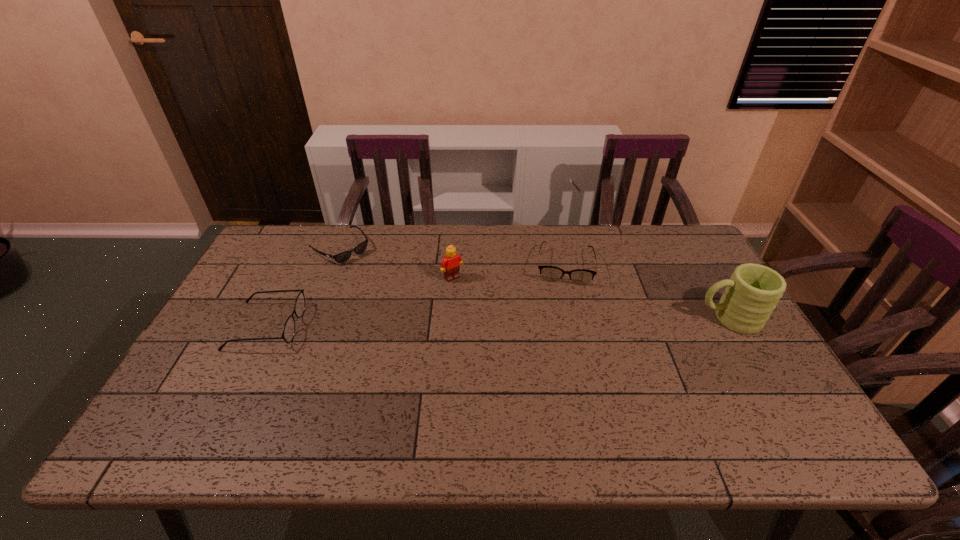
Locate an element on the screen. Image resolution: width=960 pixels, height=540 pixels. the nearer spectacles is located at coordinates (288, 332).

Image resolution: width=960 pixels, height=540 pixels. What are the coordinates of `the rightmost object` in the screenshot? It's located at (x=751, y=294).

At what (x,y) coordinates should I click in order to perform the action: click on mug. Please return your answer as a coordinate pair (x, y). This screenshot has width=960, height=540. Looking at the image, I should click on (751, 294).

Find the location of a particular element. the third object from left to right is located at coordinates (450, 265).

Find the location of `the second tallest object`. the second tallest object is located at coordinates (450, 265).

I want to click on the farther spectacles, so click(x=548, y=273).

Identify the location of the right spectacles. click(x=548, y=273).

Locate an element on the screen. The width and height of the screenshot is (960, 540). the shortest object is located at coordinates (342, 257).

The width and height of the screenshot is (960, 540). I want to click on vacant space located on the front-facing side of the left spectacles, so click(x=350, y=326).

I want to click on vacant point located on the side of the mug with the handle, so click(x=617, y=319).